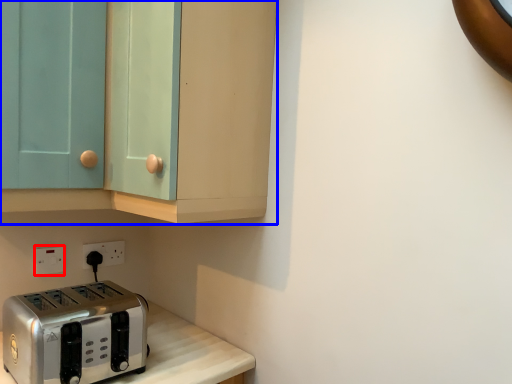
Question: Which of the following is the closest to the observer, electric outlet (highlighted by a red box) or cabinetry (highlighted by a blue box)?

Choices:
 (A) electric outlet
 (B) cabinetry

Answer: (B)